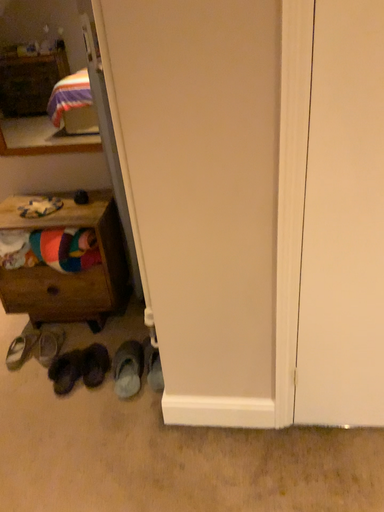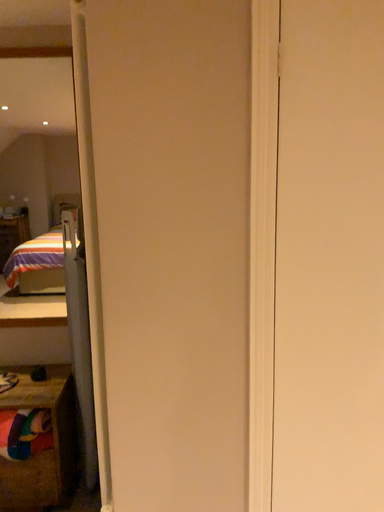
Question: How did the camera likely rotate when shooting the video?

Choices:
 (A) rotated left
 (B) rotated right

Answer: (B)